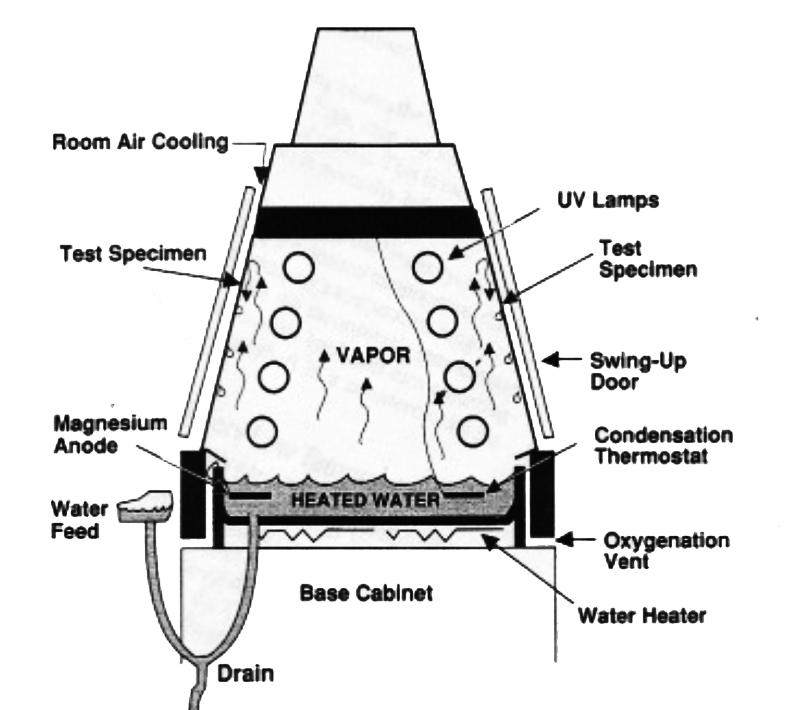
The width and height of the screenshot is (789, 710). I want to click on thermostat, so click(509, 476).